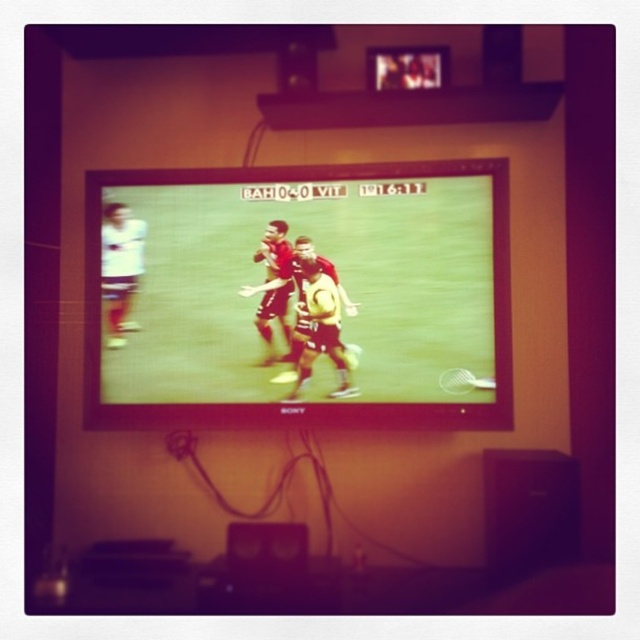
Is matte plastic television at center above yellow jersey at center?

Indeed, matte plastic television at center is positioned over yellow jersey at center.

Based on the photo, does matte plastic television at center lie behind yellow jersey at center?

No, it is in front of yellow jersey at center.

Describe the element at coordinates (300, 294) in the screenshot. The image size is (640, 640). I see `matte plastic television at center` at that location.

Find the location of `matte plastic television at center`. matte plastic television at center is located at coordinates click(300, 294).